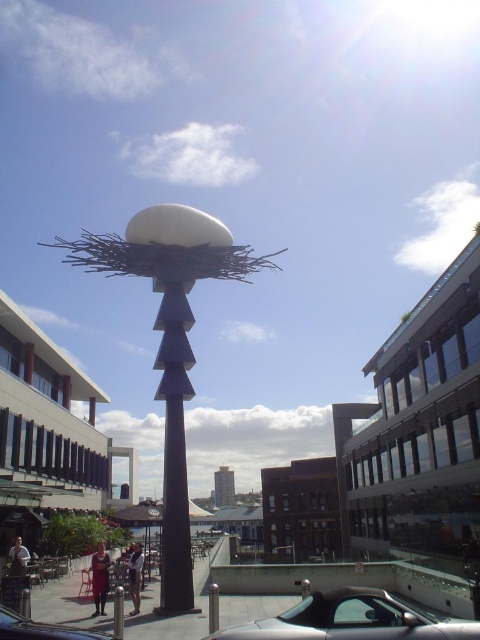
Question: Which object appears closest to the camera in this image?

Choices:
 (A) shiny silver car at lower center
 (B) shiny black car at lower left
 (C) matte white sculpture at center
 (D) black polished stone pole at center

Answer: (A)

Question: Can you confirm if black polished stone pole at center is positioned to the right of shiny black car at lower left?

Choices:
 (A) no
 (B) yes

Answer: (A)

Question: Considering the real-world distances, which object is closest to the black polished stone pole at center?

Choices:
 (A) shiny black car at lower left
 (B) shiny silver car at lower center

Answer: (B)

Question: Can you confirm if shiny silver car at lower center is positioned below shiny black car at lower left?

Choices:
 (A) no
 (B) yes

Answer: (B)

Question: Is matte white sculpture at center wider than shiny black car at lower left?

Choices:
 (A) no
 (B) yes

Answer: (B)

Question: Which of the following is the farthest from the observer?

Choices:
 (A) black polished stone pole at center
 (B) matte white sculpture at center

Answer: (B)